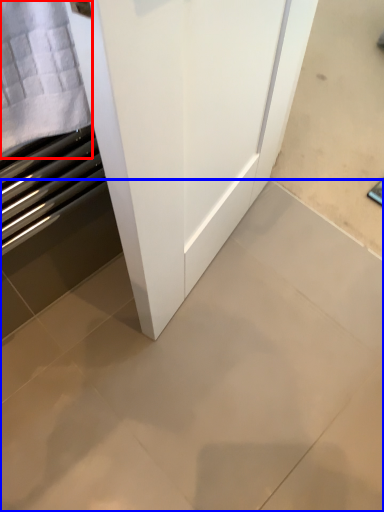
Question: Which object is closer to the camera taking this photo, cloth (highlighted by a red box) or ceramic tile (highlighted by a blue box)?

Choices:
 (A) cloth
 (B) ceramic tile

Answer: (A)